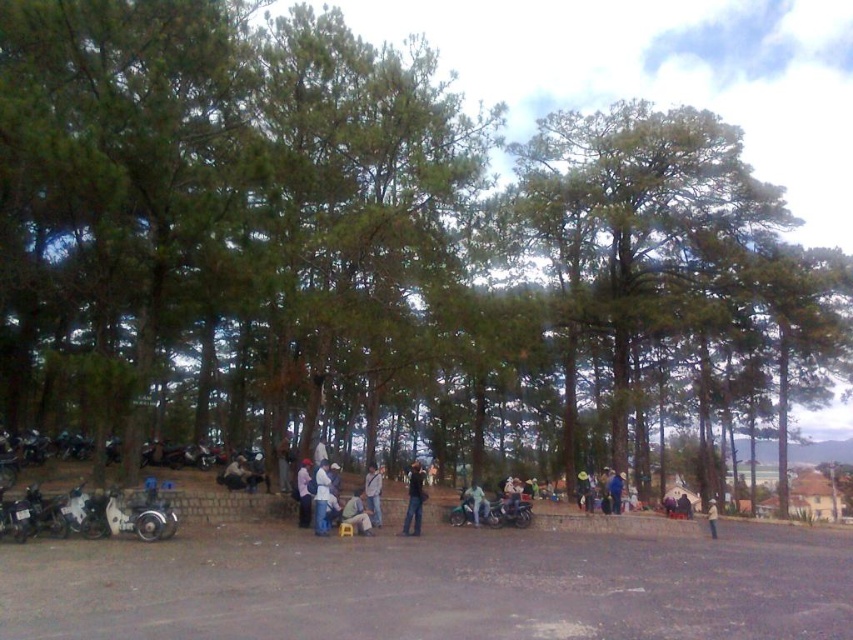
Is point (344, 518) positioned behind point (380, 492)?

No, (344, 518) is in front of (380, 492).

This screenshot has height=640, width=853. Find the location of `light brown fabric bag at center`. light brown fabric bag at center is located at coordinates (357, 513).

Between dark blue jeans at center and light brown leather jacket at center, which one is positioned higher?

dark blue jeans at center

Does dark blue jeans at center appear over light brown leather jacket at center?

Indeed, dark blue jeans at center is positioned over light brown leather jacket at center.

Does point (236, 465) come farther from viewer compared to point (480, 516)?

Yes.

Identify the location of dark blue jeans at center. (236, 474).

Between dark blue jeans at center and brown fabric hat at center, which one appears on the right side from the viewer's perspective?

From the viewer's perspective, brown fabric hat at center appears more on the right side.

Between point (224, 470) and point (709, 520), which one is positioned in front?

Point (709, 520) is more forward.

At what (x,y) coordinates should I click in order to perform the action: click on dark blue jeans at center. Please return your answer as a coordinate pair (x, y). Image resolution: width=853 pixels, height=640 pixels. Looking at the image, I should click on (236, 474).

Identify the location of dark blue jeans at center. (x=236, y=474).